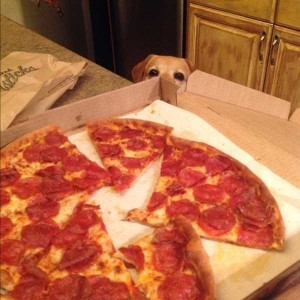
You are a GUI agent. You are given a task and a screenshot of the screen. Output one action in this format:
    pyautogui.click(x=<x>, y=<y>)
    Task: Click on the counter top
    
    Given the screenshot: What is the action you would take?
    pyautogui.click(x=28, y=38)